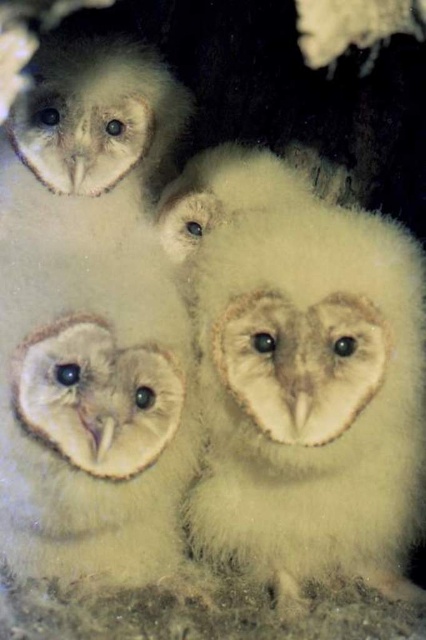
Question: Is soft white fur owl at center positioned behind soft white feathers at upper center?

Choices:
 (A) yes
 (B) no

Answer: (B)

Question: Which of the following is the closest to the observer?

Choices:
 (A) (92, 145)
 (B) (363, 438)

Answer: (B)

Question: Does soft white fur owl at center lie behind soft white feathers at upper center?

Choices:
 (A) yes
 (B) no

Answer: (B)

Question: Among these points, which one is farthest from the camera?

Choices:
 (A) (336, 292)
 (B) (152, 86)

Answer: (B)

Question: In this image, where is soft white fur owl at center located relative to soft white feathers at upper center?

Choices:
 (A) below
 (B) above

Answer: (A)

Question: Among these objects, which one is nearest to the camera?

Choices:
 (A) soft white fur owl at center
 (B) soft white feathers at upper center

Answer: (A)